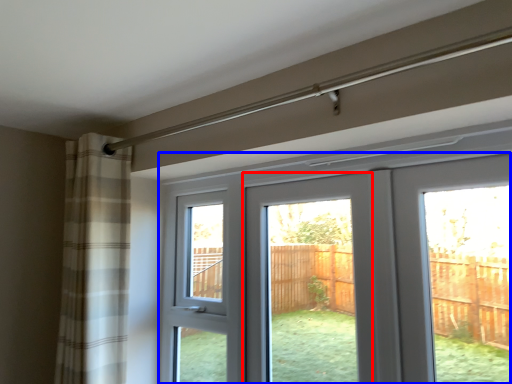
Question: Which object appears closest to the camera in this image, screen door (highlighted by a red box) or door (highlighted by a blue box)?

Choices:
 (A) screen door
 (B) door

Answer: (B)